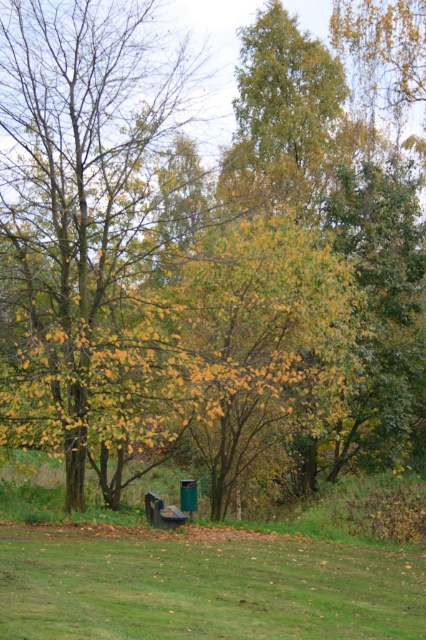
Question: Does green grassy field at lower center have a larger size compared to wooden park bench at center?

Choices:
 (A) no
 (B) yes

Answer: (B)

Question: Which of the following is the farthest from the observer?

Choices:
 (A) (175, 508)
 (B) (259, 552)
 (C) (270, 96)

Answer: (C)

Question: Which point is closer to the camera taking this photo?

Choices:
 (A) (176, 508)
 (B) (245, 154)

Answer: (A)

Question: Is green leafy tree at upper center above wooden park bench at center?

Choices:
 (A) yes
 (B) no

Answer: (A)

Question: Can you confirm if green leafy tree at upper center is smaller than wooden park bench at center?

Choices:
 (A) no
 (B) yes

Answer: (B)

Question: Which object is the closest to the wooden park bench at center?

Choices:
 (A) green leafy tree at upper center
 (B) green grassy field at lower center

Answer: (B)